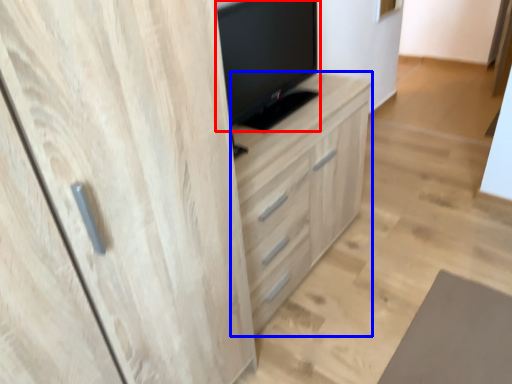
Question: Which object is closer to the camera taking this photo, television (highlighted by a red box) or chest of drawers (highlighted by a blue box)?

Choices:
 (A) television
 (B) chest of drawers

Answer: (A)